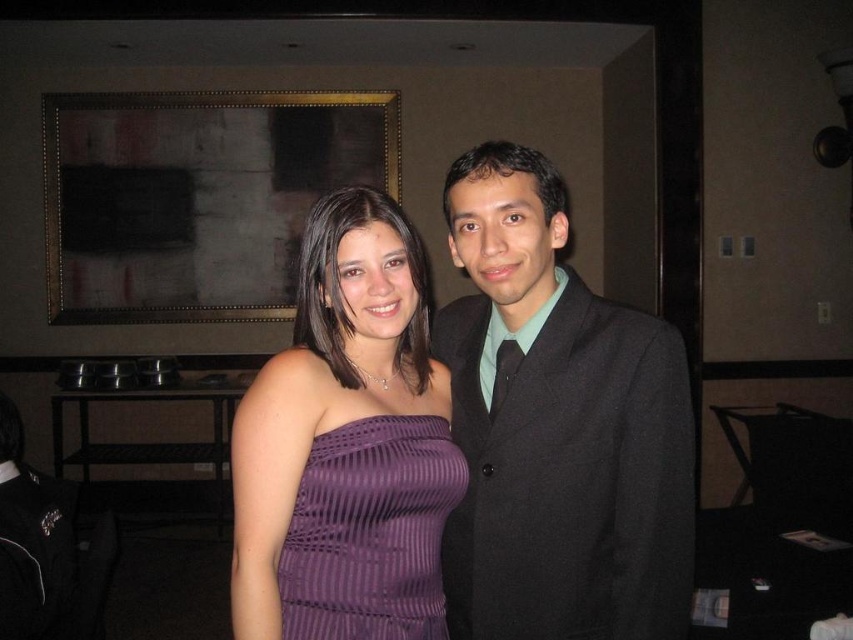
The height and width of the screenshot is (640, 853). I want to click on matte black suit at center, so click(x=556, y=428).

Is matte black suit at center below dark brown wooden picture frame at upper center?

Yes.

Does point (659, 385) come closer to viewer compared to point (310, 138)?

Yes.

This screenshot has height=640, width=853. Find the location of `matte black suit at center`. matte black suit at center is located at coordinates (556, 428).

Is point (177, 202) behind point (399, 477)?

That is True.

Is dark brown wooden picture frame at upper center closer to the viewer compared to purple striped dress at center?

No, it is behind purple striped dress at center.

You are a GUI agent. You are given a task and a screenshot of the screen. Output one action in this format:
    pyautogui.click(x=<x>, y=<y>)
    Task: Click on the dark brown wooden picture frame at upper center
    This screenshot has width=853, height=640.
    Given the screenshot: What is the action you would take?
    pyautogui.click(x=196, y=196)

Which is above, purple ribbed dress at center or purple striped dress at center?

purple ribbed dress at center is higher up.

Who is taller, purple ribbed dress at center or purple striped dress at center?

purple ribbed dress at center

The image size is (853, 640). I want to click on purple ribbed dress at center, so click(346, 444).

This screenshot has width=853, height=640. In order to click on purple ribbed dress at center in this screenshot , I will do `click(346, 444)`.